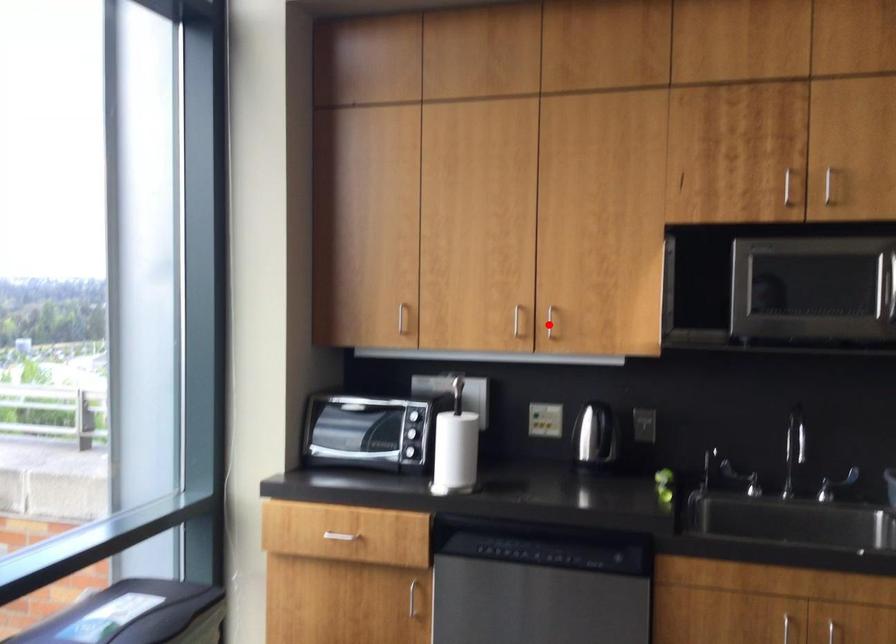
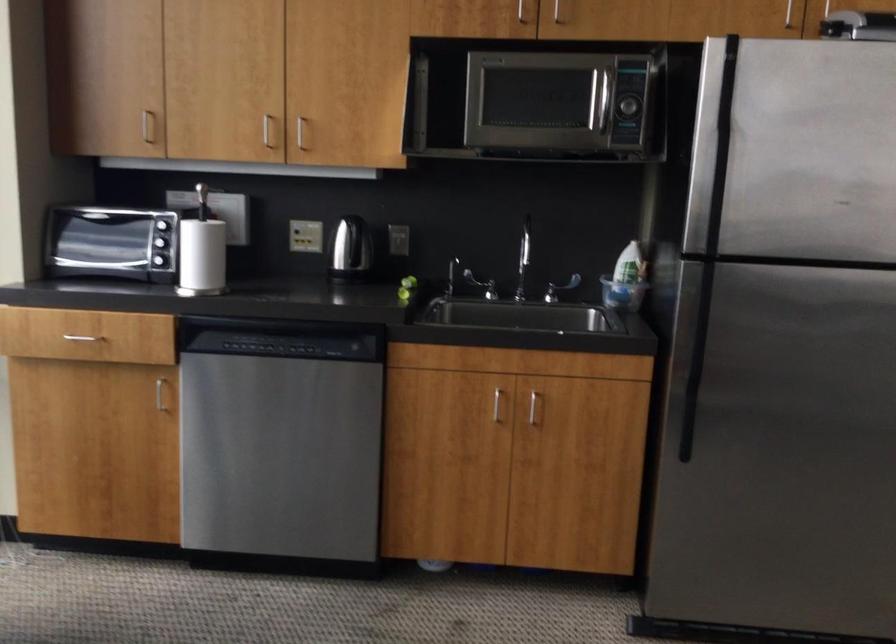
Where in the second image is the point corresponding to the highlighted location from the first image?

(300, 131)